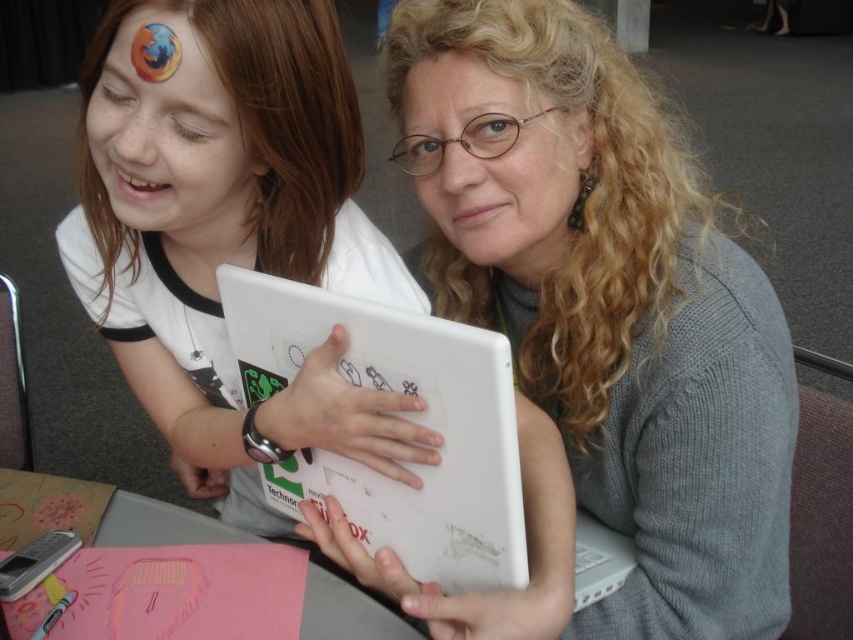
Which of these two, white matte laptop at center or matte gray face at center, stands shorter?

Standing shorter between the two is matte gray face at center.

Is white matte laptop at center thinner than matte gray face at center?

No.

The height and width of the screenshot is (640, 853). What do you see at coordinates (403, 417) in the screenshot?
I see `white matte laptop at center` at bounding box center [403, 417].

Locate an element on the screen. The width and height of the screenshot is (853, 640). white matte laptop at center is located at coordinates (403, 417).

Can you confirm if white matte tablet at center is bigger than white matte laptop at center?

Indeed, white matte tablet at center has a larger size compared to white matte laptop at center.

Which is more to the left, white matte tablet at center or white matte laptop at center?

white matte tablet at center

This screenshot has width=853, height=640. Find the location of `white matte tablet at center`. white matte tablet at center is located at coordinates (215, 204).

Is matte white face at upper left shorter than matte gray face at center?

Correct, matte white face at upper left is not as tall as matte gray face at center.

Does matte white face at upper left have a greater width compared to matte gray face at center?

Incorrect, matte white face at upper left's width does not surpass matte gray face at center's.

Where is `matte white face at upper left`? The width and height of the screenshot is (853, 640). matte white face at upper left is located at coordinates (167, 134).